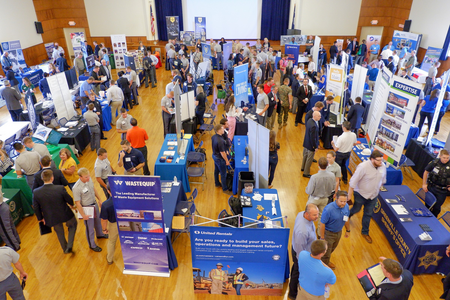
Where is `green table cloth`? Image resolution: width=450 pixels, height=300 pixels. green table cloth is located at coordinates (22, 184).